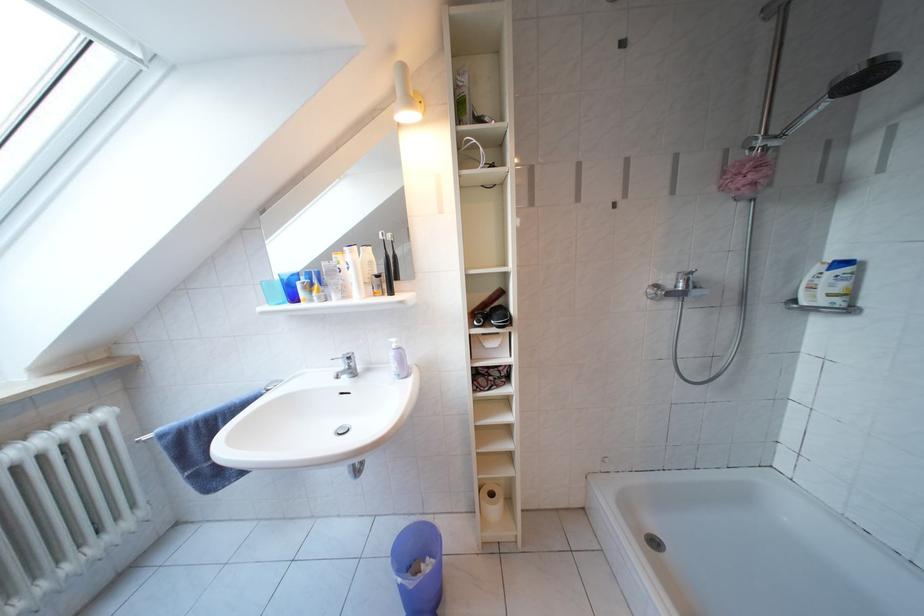
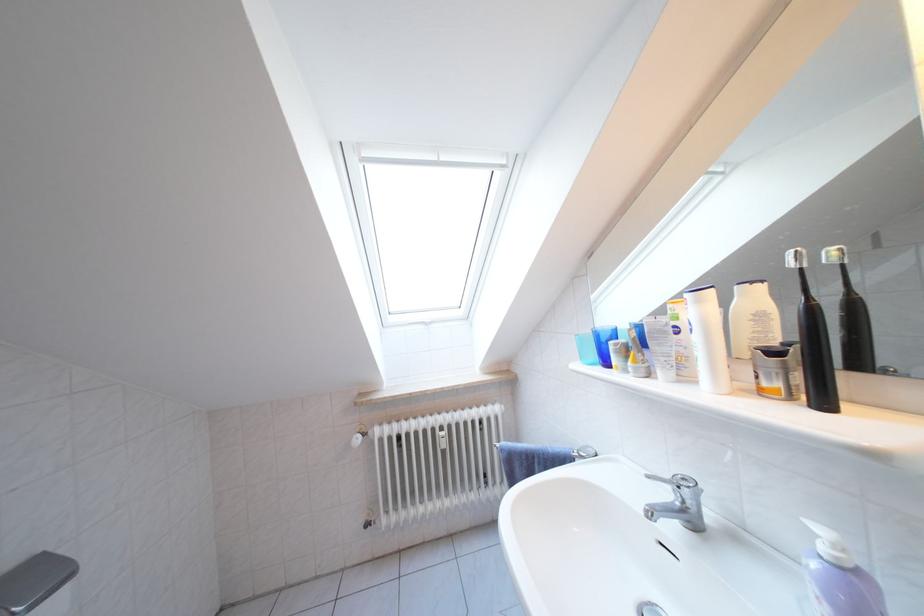
Locate, in the second image, the point that corresponds to (359,257) in the first image.

(708, 306)